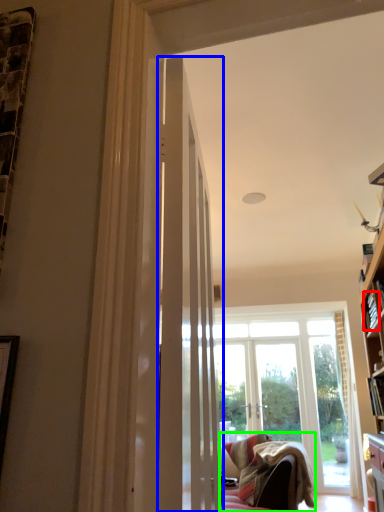
Question: Which is nearer to the book (highlighted by a red box)? door (highlighted by a blue box) or studio couch (highlighted by a green box).

Choices:
 (A) door
 (B) studio couch

Answer: (B)